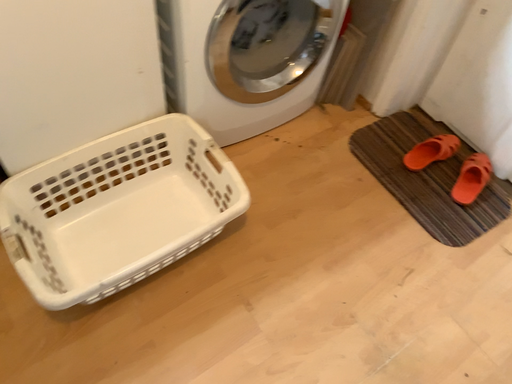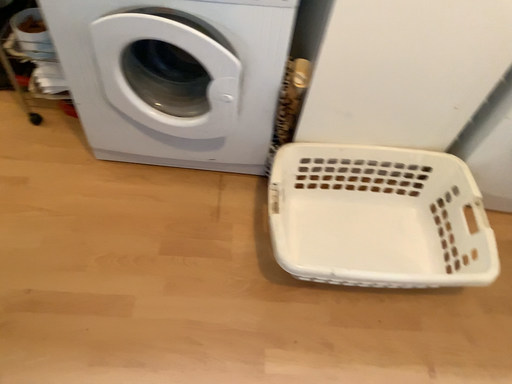
Question: How did the camera likely rotate when shooting the video?

Choices:
 (A) rotated downward
 (B) rotated upward

Answer: (B)